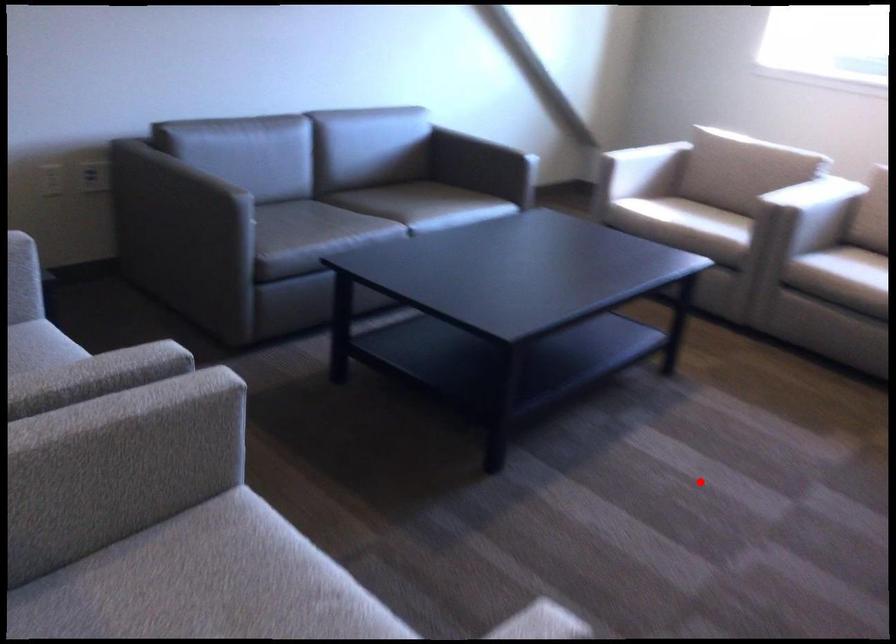
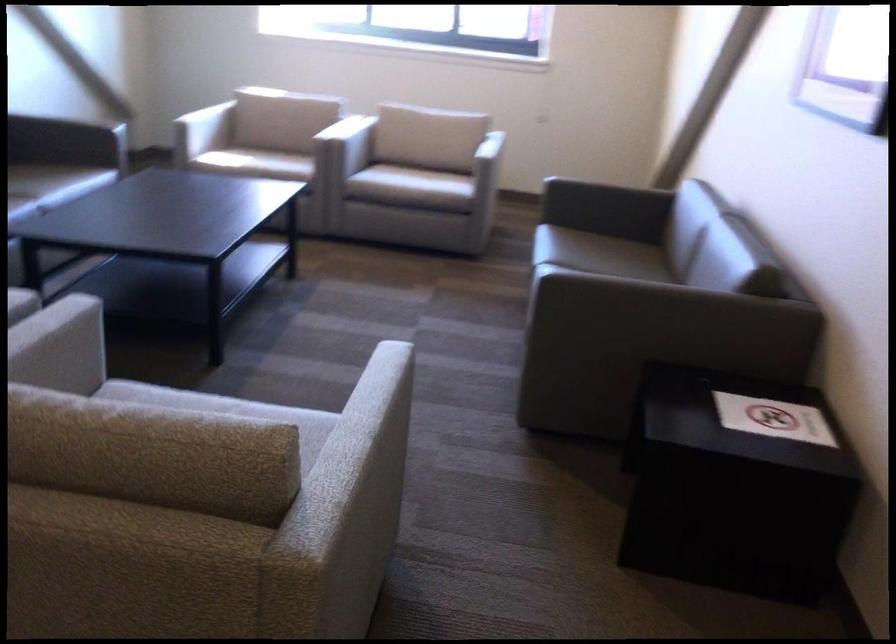
Question: I am providing you with two images of the same scene from different viewpoints. A red point is shown in image1. For the corresponding object point in image2, is it positioned nearer or farther from the camera?

Choices:
 (A) Nearer
 (B) Farther

Answer: (B)